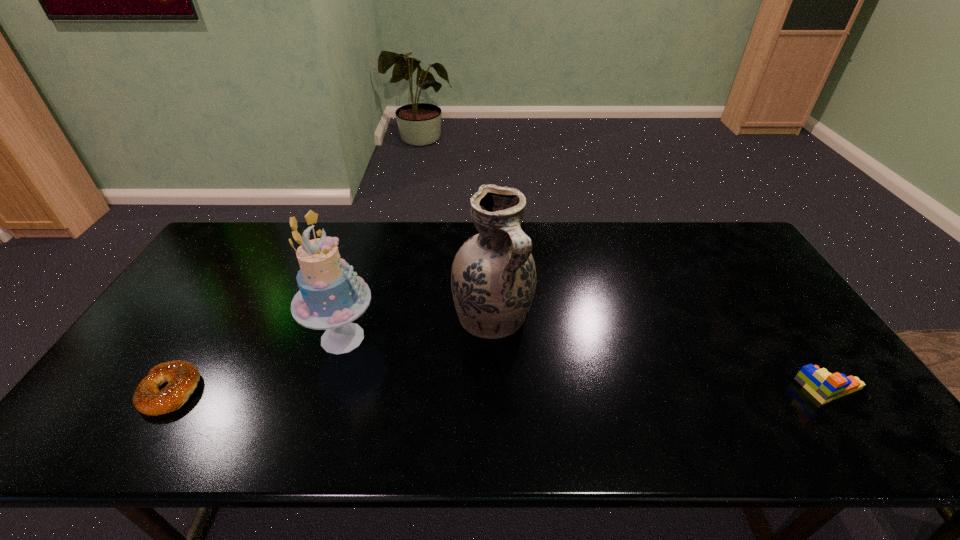
Locate an element on the screen. Image resolution: width=960 pixels, height=540 pixels. bagel is located at coordinates (182, 377).

Where is `the leftmost object`? the leftmost object is located at coordinates (182, 377).

Where is `the second shortest object`? The image size is (960, 540). the second shortest object is located at coordinates (824, 386).

The image size is (960, 540). What are the coordinates of `the rightmost object` in the screenshot? It's located at (824, 386).

Identify the location of the second object from left to right. (331, 295).

The image size is (960, 540). I want to click on the second object from right to left, so click(x=493, y=279).

Where is `free space located 0.050m on the back of the bagel`? free space located 0.050m on the back of the bagel is located at coordinates click(196, 351).

At what (x,y) coordinates should I click in order to perform the action: click on vacant space located on the back of the second shortest object. Please return your answer as a coordinate pair (x, y). This screenshot has height=540, width=960. Looking at the image, I should click on (768, 299).

I want to click on free space located with a ladder on the side of the second object from left to right, so click(448, 394).

Identify the location of vacant space located with a ladder on the side of the second object from left to right. Image resolution: width=960 pixels, height=540 pixels. (432, 384).